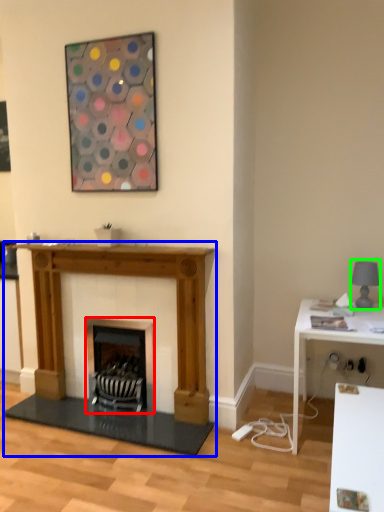
Question: Which is farther away from wood burning stove (highlighted by a red box)? fireplace (highlighted by a blue box) or lamp (highlighted by a green box)?

Choices:
 (A) fireplace
 (B) lamp

Answer: (B)